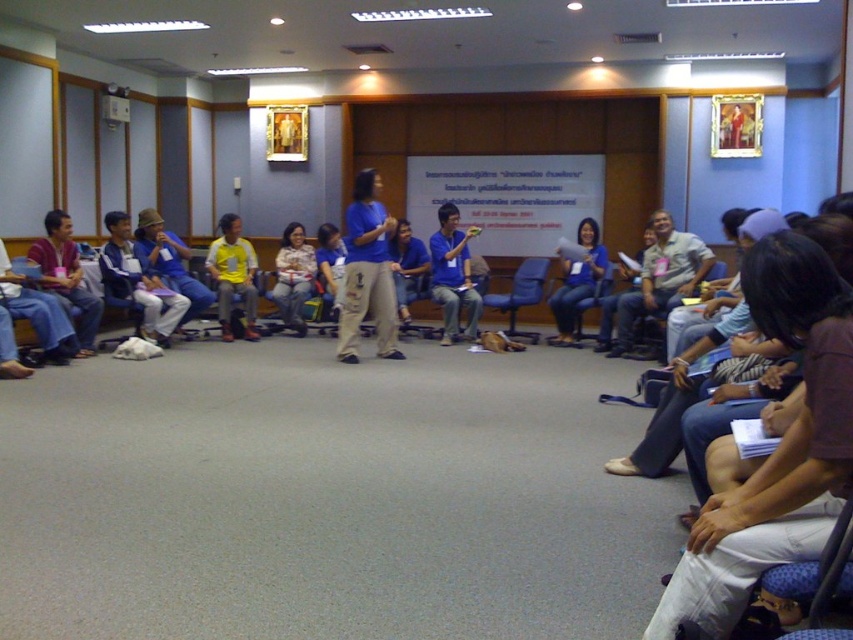
Question: Can you confirm if matte blue shirt at center is positioned below blue fabric chair at center?

Choices:
 (A) yes
 (B) no

Answer: (B)

Question: Which object appears farthest from the camera in this image?

Choices:
 (A) matte blue shirt at center
 (B) blue fabric chair at center

Answer: (B)

Question: Among these objects, which one is farthest from the camera?

Choices:
 (A) matte blue shirt at center
 (B) matte plastic chair at center

Answer: (A)

Question: Can you confirm if matte blue shirt at center is positioned to the right of light brown fabric pants at center?

Choices:
 (A) yes
 (B) no

Answer: (A)

Question: Which object is farther from the camera taking this photo?

Choices:
 (A) blue fabric chair at center
 (B) matte plastic chair at center
 (C) light brown fabric pants at center
 (D) matte blue shirt at center

Answer: (C)

Question: Is light brown fabric pants at center further to the viewer compared to blue fabric chair at center?

Choices:
 (A) no
 (B) yes

Answer: (B)